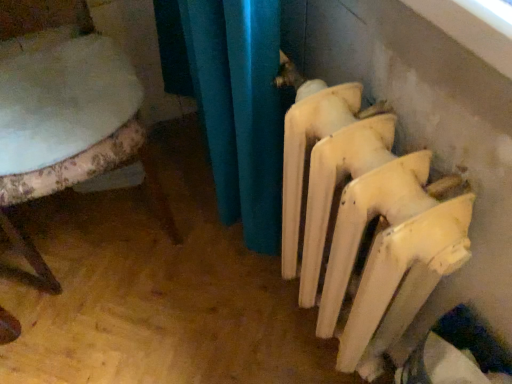
Question: From the image's perspective, relative to white matte radiator at lower right, is white fabric chair at left above or below?

Choices:
 (A) above
 (B) below

Answer: (A)

Question: From a real-world perspective, is white fabric chair at left physically located above or below white matte radiator at lower right?

Choices:
 (A) below
 (B) above

Answer: (A)

Question: Would you say white fabric chair at left is inside or outside white matte radiator at lower right?

Choices:
 (A) inside
 (B) outside

Answer: (B)

Question: In terms of width, does white matte radiator at lower right look wider or thinner when compared to white fabric chair at left?

Choices:
 (A) wide
 (B) thin

Answer: (B)

Question: From a real-world perspective, is white matte radiator at lower right above or below white fabric chair at left?

Choices:
 (A) above
 (B) below

Answer: (A)

Question: Is point (283, 274) closer or farther from the camera than point (10, 228)?

Choices:
 (A) closer
 (B) farther

Answer: (A)

Question: Considering the positions of white matte radiator at lower right and white fabric chair at left in the image, is white matte radiator at lower right taller or shorter than white fabric chair at left?

Choices:
 (A) short
 (B) tall

Answer: (A)